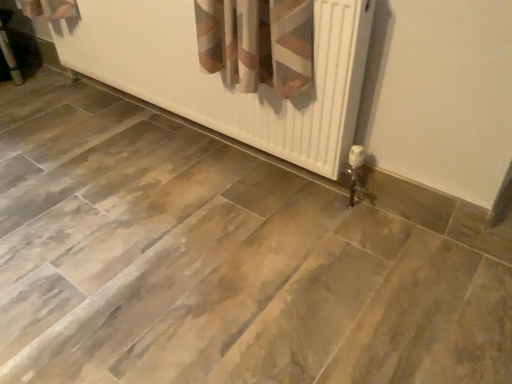
Describe the element at coordinates (220, 78) in the screenshot. Image resolution: width=512 pixels, height=384 pixels. I see `white matte radiator at center` at that location.

Locate an element on the screen. white matte radiator at center is located at coordinates (220, 78).

Image resolution: width=512 pixels, height=384 pixels. I want to click on white matte radiator at center, so click(x=220, y=78).